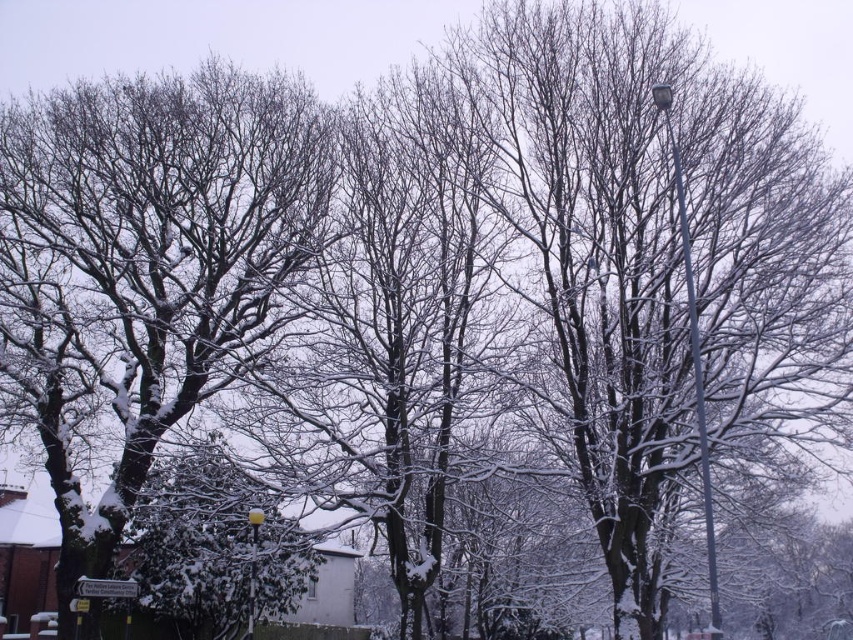
Question: Can you confirm if metallic gray pole at right is positioned to the right of yellow glass lamp post at center?

Choices:
 (A) yes
 (B) no

Answer: (A)

Question: Does snow-covered branches at left appear on the left side of metallic gray pole at right?

Choices:
 (A) yes
 (B) no

Answer: (A)

Question: Does snow-covered branches at left lie in front of metallic gray pole at right?

Choices:
 (A) no
 (B) yes

Answer: (A)

Question: Based on their relative distances, which object is nearer to the snow-covered branches at left?

Choices:
 (A) metallic gray pole at right
 (B) yellow glass lamp post at center

Answer: (B)

Question: Which is nearer to the metallic gray pole at right?

Choices:
 (A) yellow glass lamp post at center
 (B) snow-covered branches at left

Answer: (A)

Question: Among these points, which one is farthest from the camera?

Choices:
 (A) (250, 592)
 (B) (108, 186)
 (C) (671, 148)

Answer: (A)